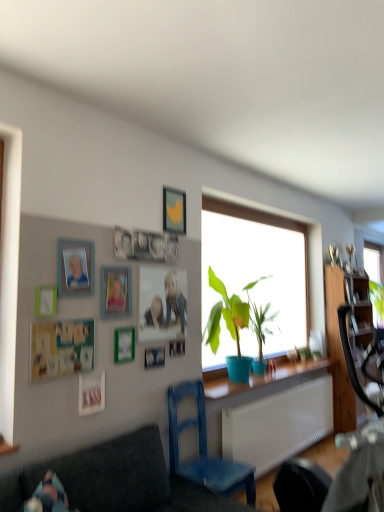
Where is `wooden picture frame at center, which ranks as the 9th picture frame in top-to-bottom order`? This screenshot has width=384, height=512. wooden picture frame at center, which ranks as the 9th picture frame in top-to-bottom order is located at coordinates (154, 357).

From the picture: What is the approximate width of matte pink picture frame at lower left, marked as the first picture frame in a bottom-to-top arrangement?

matte pink picture frame at lower left, marked as the first picture frame in a bottom-to-top arrangement, is 0.99 inches wide.

This screenshot has width=384, height=512. I want to click on matte pink picture frame at lower left, marked as the first picture frame in a bottom-to-top arrangement, so click(91, 393).

Measure the distance between point (156,267) and camera.

Point (156,267) is 9.92 feet away from camera.

Describe the element at coordinates (162, 303) in the screenshot. The height and width of the screenshot is (512, 384). I see `matte wooden picture frame at center, placed as the 6th picture frame when sorted from bottom to top` at that location.

What is the approximate height of matte plastic picture frame at upper left, arranged as the 2th picture frame when viewed from the top?

The height of matte plastic picture frame at upper left, arranged as the 2th picture frame when viewed from the top, is 34.03 centimeters.

How much space does yellow matte picture frame at upper center, the tenth picture frame when ordered from bottom to top, occupy horizontally?

The width of yellow matte picture frame at upper center, the tenth picture frame when ordered from bottom to top, is 2.49 centimeters.

You are a GUI agent. You are given a task and a screenshot of the screen. Output one action in this format:
    pyautogui.click(x=<x>, y=<y>)
    Task: Click on the wooden picture frame at center, the second picture frame ordered from the bottom
    The image size is (384, 512).
    Given the screenshot: What is the action you would take?
    pyautogui.click(x=154, y=357)

From the image's perspective, is matte plastic picture frame at upper center, placed as the third picture frame when sorted from top to bottom, on top of wooden picture frame at upper left, acting as the fourth picture frame starting from the top?

Yes.

From a real-world perspective, between matte plastic picture frame at upper center, the eighth picture frame in the bottom-to-top sequence, and wooden picture frame at upper left, acting as the seventh picture frame starting from the bottom, who is vertically higher?

matte plastic picture frame at upper center, the eighth picture frame in the bottom-to-top sequence.

Is matte plastic picture frame at upper center, the eighth picture frame in the bottom-to-top sequence, outside of wooden picture frame at upper left, acting as the fourth picture frame starting from the top?

Indeed, matte plastic picture frame at upper center, the eighth picture frame in the bottom-to-top sequence, is completely outside wooden picture frame at upper left, acting as the fourth picture frame starting from the top.

Which object is thinner, matte plastic picture frame at upper center, placed as the third picture frame when sorted from top to bottom, or wooden picture frame at upper left, acting as the seventh picture frame starting from the bottom?

matte plastic picture frame at upper center, placed as the third picture frame when sorted from top to bottom.

Which object is closer to the camera taking this photo, wooden picture frame at center, the second picture frame ordered from the bottom, or matte blue pot at center?

Positioned in front is wooden picture frame at center, the second picture frame ordered from the bottom.

Could you tell me if wooden picture frame at center, the second picture frame ordered from the bottom, is turned towards matte blue pot at center?

No, wooden picture frame at center, the second picture frame ordered from the bottom, is not turned towards matte blue pot at center.

Which of these two, wooden picture frame at center, which ranks as the 9th picture frame in top-to-bottom order, or matte blue pot at center, is smaller?

wooden picture frame at center, which ranks as the 9th picture frame in top-to-bottom order.

From a real-world perspective, relative to matte blue pot at center, is wooden picture frame at center, the second picture frame ordered from the bottom, vertically above or below?

wooden picture frame at center, the second picture frame ordered from the bottom, is situated lower than matte blue pot at center in the real world.

Find the location of `chair in front of the wooden cabinet at right`. chair in front of the wooden cabinet at right is located at coordinates (204, 450).

Which point is more distant from viewer, (226, 481) or (332, 374)?

The point (332, 374) is more distant.

Is blue painted wood chair at lower center touching wooden cabinet at right?

blue painted wood chair at lower center is not next to wooden cabinet at right, and they're not touching.

Is blue painted wood chair at lower center smaller than wooden cabinet at right?

Yes, blue painted wood chair at lower center is smaller than wooden cabinet at right.

Is teal matte board at lower left, the fifth picture frame positioned from the bottom, taller or shorter than matte plastic picture frame at upper center, the eighth picture frame in the bottom-to-top sequence?

In the image, teal matte board at lower left, the fifth picture frame positioned from the bottom, appears to be shorter than matte plastic picture frame at upper center, the eighth picture frame in the bottom-to-top sequence.

Which is correct: teal matte board at lower left, the fifth picture frame positioned from the bottom, is inside matte plastic picture frame at upper center, placed as the third picture frame when sorted from top to bottom, or outside of it?

teal matte board at lower left, the fifth picture frame positioned from the bottom, is spatially situated outside matte plastic picture frame at upper center, placed as the third picture frame when sorted from top to bottom.

Considering their positions, is teal matte board at lower left, the fifth picture frame positioned from the bottom, located in front of or behind matte plastic picture frame at upper center, placed as the third picture frame when sorted from top to bottom?

Clearly, teal matte board at lower left, the fifth picture frame positioned from the bottom, is in front of matte plastic picture frame at upper center, placed as the third picture frame when sorted from top to bottom.

Considering the positions of points (48, 298) and (237, 343), is point (48, 298) closer to camera compared to point (237, 343)?

Yes, point (48, 298) is in front of point (237, 343).

Locate an element on the screen. This screenshot has height=512, width=384. houseplant behind the wooden picture frame at upper left, acting as the fourth picture frame starting from the top is located at coordinates (228, 327).

Which object is thinner, wooden picture frame at upper left, acting as the fourth picture frame starting from the top, or matte blue pot at center?

wooden picture frame at upper left, acting as the fourth picture frame starting from the top.

From the picture: Which is more to the right, wooden picture frame at upper left, acting as the fourth picture frame starting from the top, or matte blue pot at center?

matte blue pot at center is more to the right.

In terms of size, does matte blue pot at center appear bigger or smaller than wooden cabinet at right?

In the image, matte blue pot at center appears to be smaller than wooden cabinet at right.

Would you say matte blue pot at center is to the left or to the right of wooden cabinet at right in the picture?

In the image, matte blue pot at center appears on the left side of wooden cabinet at right.

Looking at this image, from the image's perspective, is matte blue pot at center below wooden cabinet at right?

No, from the image's perspective, matte blue pot at center is not below wooden cabinet at right.

Identify the location of cabinetry located behind the matte blue pot at center. (348, 338).

How many degrees apart are the facing directions of dark gray fabric couch at lower left and wooden picture frame at center, marked as the 3th picture frame in a bottom-to-top arrangement?

1.04 degrees separate the facing orientations of dark gray fabric couch at lower left and wooden picture frame at center, marked as the 3th picture frame in a bottom-to-top arrangement.

Visually, is dark gray fabric couch at lower left positioned to the left or to the right of wooden picture frame at center, arranged as the 8th picture frame when viewed from the top?

Based on their positions, dark gray fabric couch at lower left is located to the right of wooden picture frame at center, arranged as the 8th picture frame when viewed from the top.

Which point is more distant from viewer, (18, 496) or (170, 350)?

Positioned behind is point (170, 350).

Who is taller, dark gray fabric couch at lower left or wooden picture frame at center, arranged as the 8th picture frame when viewed from the top?

dark gray fabric couch at lower left is taller.

Image resolution: width=384 pixels, height=512 pixels. What are the coordinates of `picture frame that is the 1st one when counting upward from the wooden picture frame at upper left, acting as the fourth picture frame starting from the top (from the image's perspective)` in the screenshot? It's located at (115, 292).

The width and height of the screenshot is (384, 512). I want to click on houseplant behind the wooden picture frame at center, which ranks as the 9th picture frame in top-to-bottom order, so click(x=228, y=327).

Which object lies nearer to the anchor point wooden picture frame at upper left, acting as the fourth picture frame starting from the top, wooden picture frame at center, the second picture frame ordered from the bottom, or matte pink picture frame at lower left, the 10th picture frame in the top-to-bottom sequence?

The object closer to wooden picture frame at upper left, acting as the fourth picture frame starting from the top, is matte pink picture frame at lower left, the 10th picture frame in the top-to-bottom sequence.

Based on their spatial positions, is wooden rocking chair at lower right or wooden picture frame at center, arranged as the 8th picture frame when viewed from the top, closer to green matte picture frame at upper center, which is the 7th picture frame from top to bottom?

Among the two, wooden picture frame at center, arranged as the 8th picture frame when viewed from the top, is located nearer to green matte picture frame at upper center, which is the 7th picture frame from top to bottom.

When comparing their distances from matte pink picture frame at lower left, the 10th picture frame in the top-to-bottom sequence, does wooden rocking chair at lower right or wooden cabinet at right seem further?

The object further to matte pink picture frame at lower left, the 10th picture frame in the top-to-bottom sequence, is wooden cabinet at right.

When comparing their distances from wooden picture frame at upper left, acting as the seventh picture frame starting from the bottom, does wooden picture frame at center, arranged as the 8th picture frame when viewed from the top, or teal matte board at lower left, the fifth picture frame positioned from the bottom, seem closer?

teal matte board at lower left, the fifth picture frame positioned from the bottom, is closer to wooden picture frame at upper left, acting as the seventh picture frame starting from the bottom.

Which object lies further to the anchor point teal matte board at lower left, which is counted as the sixth picture frame, starting from the top, matte plastic picture frame at upper center, the eighth picture frame in the bottom-to-top sequence, or dark gray fabric couch at lower left?

The object further to teal matte board at lower left, which is counted as the sixth picture frame, starting from the top, is dark gray fabric couch at lower left.

From the image, which object appears to be nearer to matte pink picture frame at lower left, marked as the first picture frame in a bottom-to-top arrangement, green matte picture frame at upper center, which is the 7th picture frame from top to bottom, or teal matte board at lower left, the fifth picture frame positioned from the bottom?

The object closer to matte pink picture frame at lower left, marked as the first picture frame in a bottom-to-top arrangement, is teal matte board at lower left, the fifth picture frame positioned from the bottom.

Based on their spatial positions, is wooden picture frame at upper left, acting as the fourth picture frame starting from the top, or teal matte board at lower left, which is counted as the sixth picture frame, starting from the top, further from wooden picture frame at center, arranged as the 8th picture frame when viewed from the top?

wooden picture frame at upper left, acting as the fourth picture frame starting from the top, is positioned further to the anchor wooden picture frame at center, arranged as the 8th picture frame when viewed from the top.

From the image, which object appears to be farther from dark gray fabric couch at lower left, wooden cabinet at right or matte wooden picture frame at center, which is counted as the fifth picture frame, starting from the top?

wooden cabinet at right is positioned further to the anchor dark gray fabric couch at lower left.

Identify the location of houseplant located between teal matte board at lower left, the fifth picture frame positioned from the bottom, and wooden cabinet at right in the left-right direction. pos(228,327).

At what (x,y) coordinates should I click in order to perform the action: click on rocking chair positioned between dark gray fabric couch at lower left and matte blue pot at center from near to far. Please return your answer as a coordinate pair (x, y). Looking at the image, I should click on (338, 477).

The height and width of the screenshot is (512, 384). Identify the location of chair between wooden rocking chair at lower right and wooden picture frame at center, marked as the 3th picture frame in a bottom-to-top arrangement, in the front-back direction. (204, 450).

What are the coordinates of `houseplant between matte plastic picture frame at upper left, the 9th picture frame positioned from the bottom, and wooden cabinet at right` in the screenshot? It's located at (228, 327).